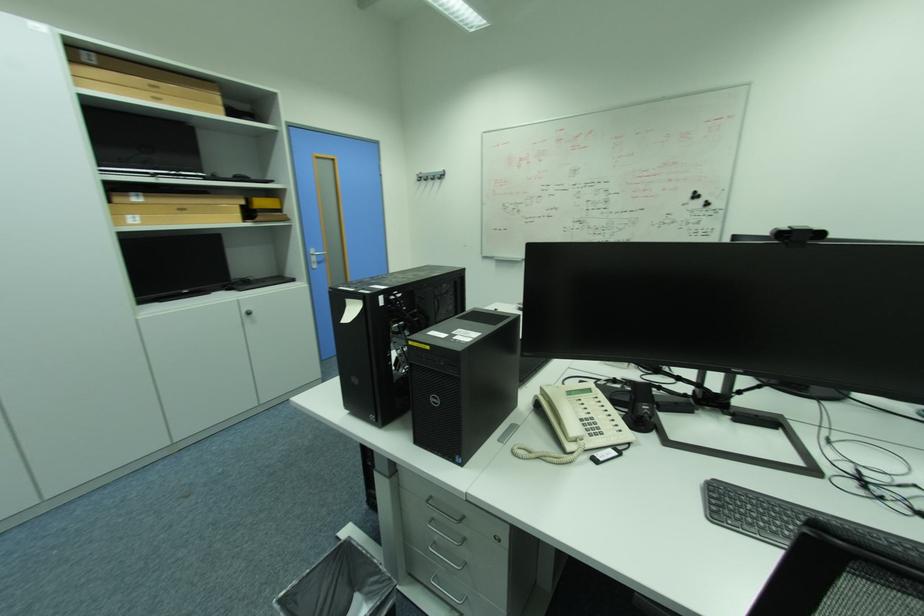
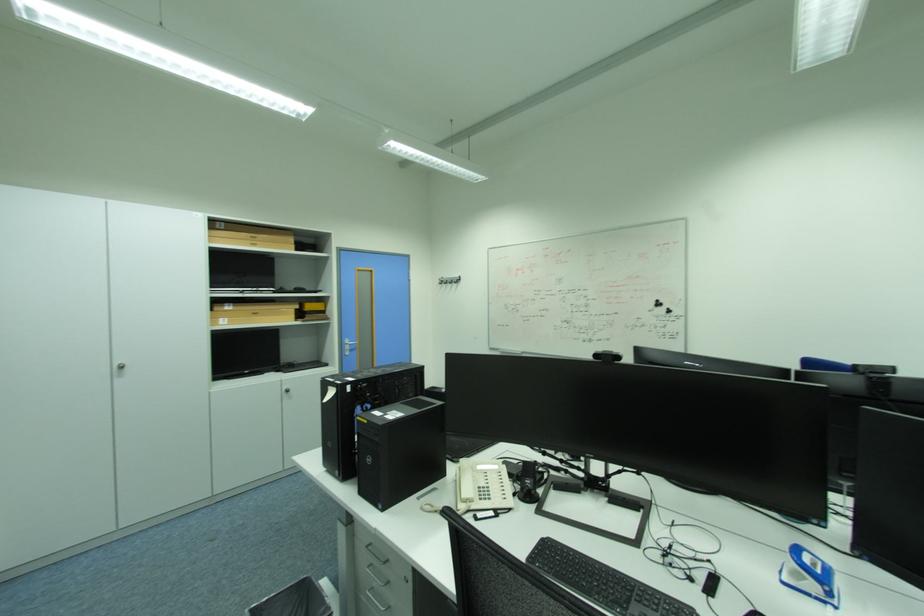
The point at [430,184] is marked in the first image. Where is the corresponding point in the second image?

(451, 286)